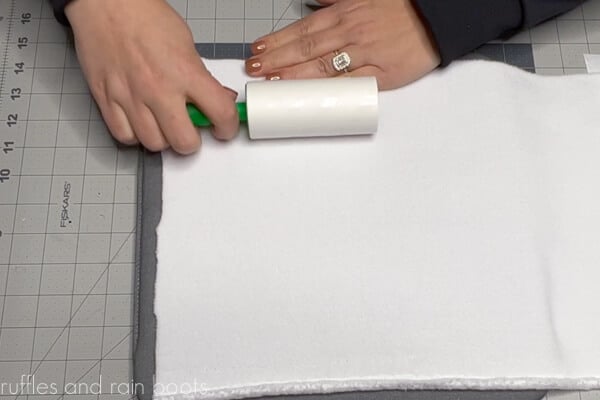
Image resolution: width=600 pixels, height=400 pixels. I want to click on handle, so click(222, 115).